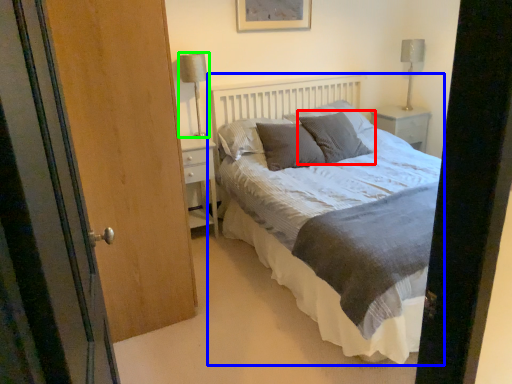
Question: Which object is positioned closest to pillow (highlighted by a red box)? Select from bed (highlighted by a blue box) and table lamp (highlighted by a green box).

Choices:
 (A) bed
 (B) table lamp

Answer: (A)